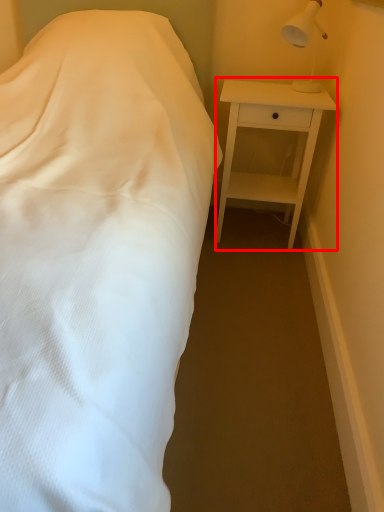
Question: From the image's perspective, what is the correct spatial positioning of nightstand (annotated by the red box) in reference to lamp?

Choices:
 (A) above
 (B) below

Answer: (B)